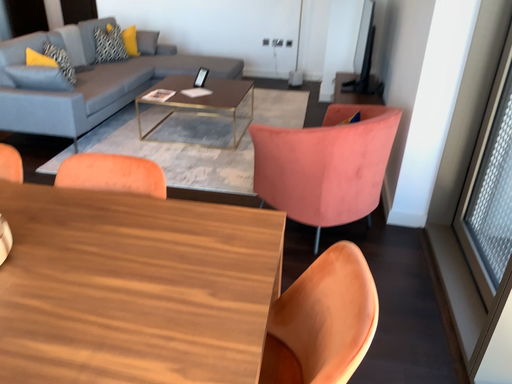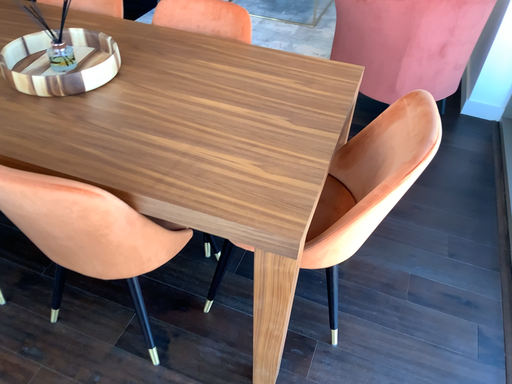
Question: How did the camera likely rotate when shooting the video?

Choices:
 (A) rotated downward
 (B) rotated upward

Answer: (A)